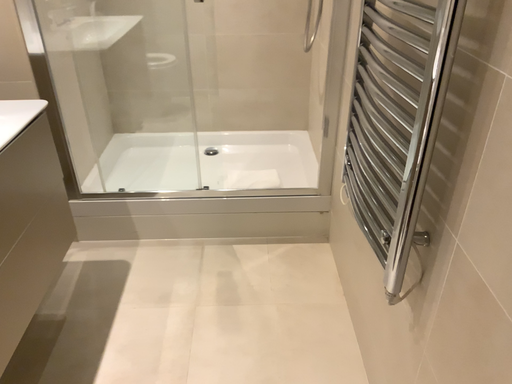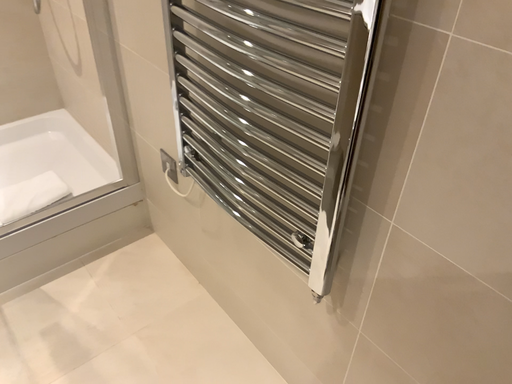
Question: Which way did the camera rotate in the video?

Choices:
 (A) rotated left
 (B) rotated right

Answer: (B)